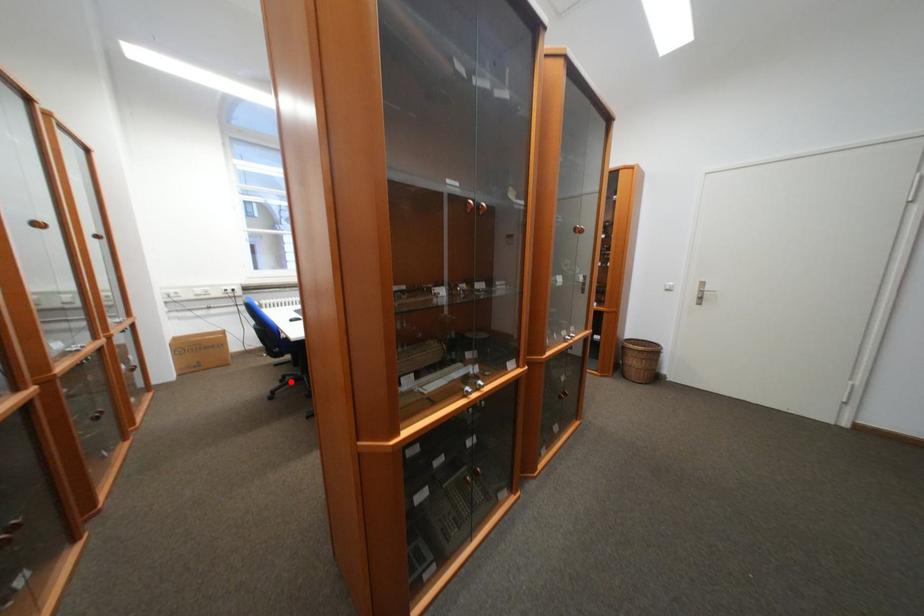
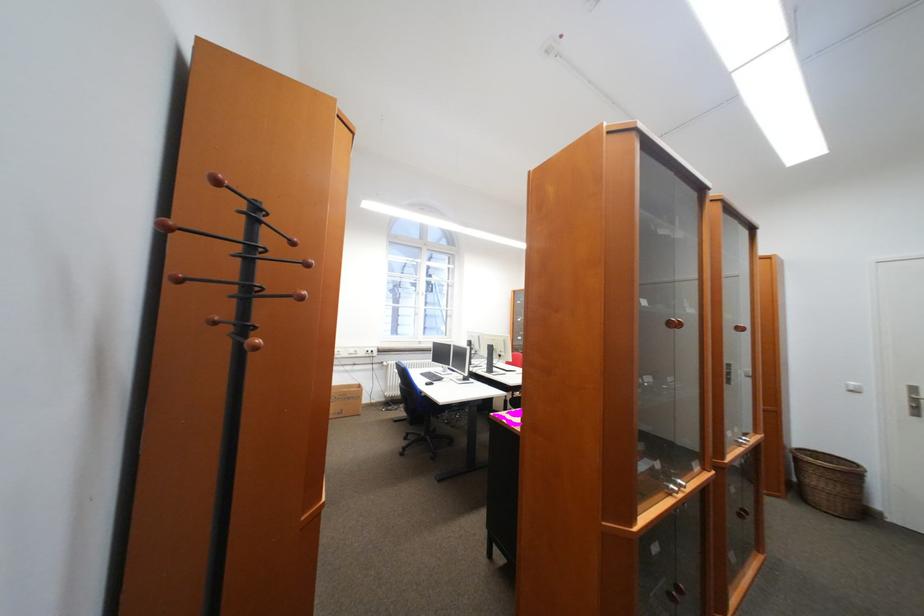
The point at the highlighted location is marked in the first image. Where is the corresponding point in the second image?

(415, 439)